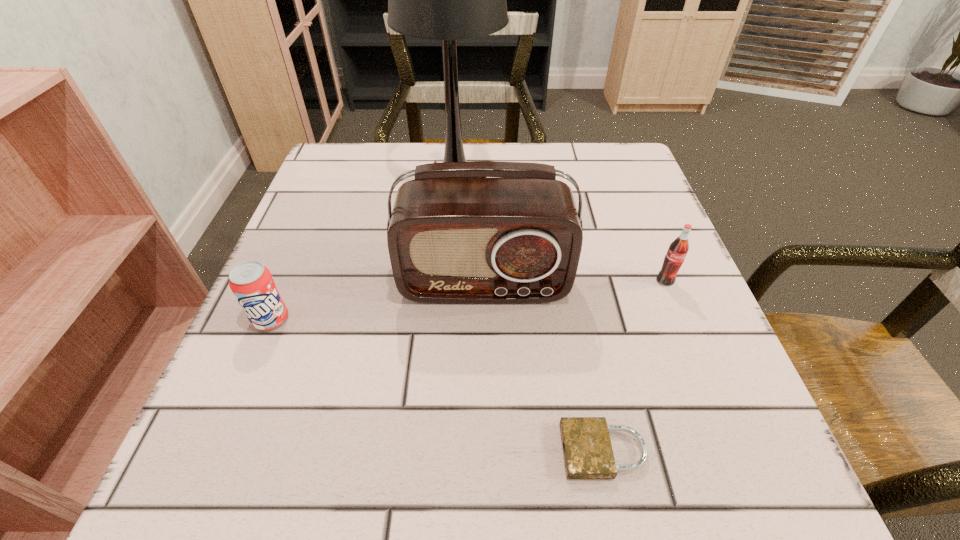
At what (x,y) coordinates should I click in order to perform the action: click on free point between the radio receiver and the padlock. Please return your answer as a coordinate pair (x, y). The image size is (960, 540). Looking at the image, I should click on (543, 368).

Find the location of a particular element. empty location between the radio receiver and the rightmost object is located at coordinates (574, 283).

What are the coordinates of `vacant space that's between the fourth shortest object and the second shortest object` in the screenshot? It's located at (377, 301).

I want to click on vacant area that lies between the second shortest object and the radio receiver, so click(x=377, y=301).

Locate an element on the screen. vacant region between the fourth tallest object and the second tallest object is located at coordinates (377, 301).

This screenshot has width=960, height=540. I want to click on object that ranks as the third closest to the farthest object, so click(678, 249).

Locate which object is the closest to the table lamp. Please provide its 2D coordinates. Your answer should be formatted as a tuple, i.e. [(x, y)], where the tuple contains the x and y coordinates of a point satisfying the conditions above.

[(452, 239)]

The height and width of the screenshot is (540, 960). Find the location of `free spot that satisfies the following two spatial constraints: 1. on the label of the farther soda can; 2. on the keyhole side of the padlock`. free spot that satisfies the following two spatial constraints: 1. on the label of the farther soda can; 2. on the keyhole side of the padlock is located at coordinates (733, 451).

Find the location of `blank space that satisfies the following two spatial constraints: 1. on the label of the right soda can; 2. on the keyhole side of the nearest object`. blank space that satisfies the following two spatial constraints: 1. on the label of the right soda can; 2. on the keyhole side of the nearest object is located at coordinates (733, 451).